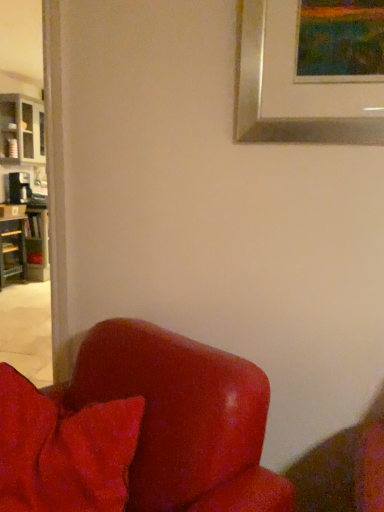
Question: Does velvety red pillow at lower left have a smaller size compared to wooden bookshelf at left?

Choices:
 (A) no
 (B) yes

Answer: (B)

Question: Considering the relative sizes of velvety red pillow at lower left and wooden bookshelf at left in the image provided, is velvety red pillow at lower left bigger than wooden bookshelf at left?

Choices:
 (A) yes
 (B) no

Answer: (B)

Question: Is velvety red pillow at lower left positioned in front of wooden bookshelf at left?

Choices:
 (A) yes
 (B) no

Answer: (A)

Question: From the image's perspective, would you say velvety red pillow at lower left is shown under wooden bookshelf at left?

Choices:
 (A) yes
 (B) no

Answer: (A)

Question: From the image's perspective, is velvety red pillow at lower left on wooden bookshelf at left?

Choices:
 (A) yes
 (B) no

Answer: (B)

Question: Can you confirm if velvety red pillow at lower left is positioned to the left of wooden bookshelf at left?

Choices:
 (A) yes
 (B) no

Answer: (B)

Question: Is matte gray cabinet at left outside of wooden bookshelf at left?

Choices:
 (A) yes
 (B) no

Answer: (A)

Question: Is matte gray cabinet at left next to wooden bookshelf at left and touching it?

Choices:
 (A) yes
 (B) no

Answer: (B)

Question: Does matte gray cabinet at left have a smaller size compared to wooden bookshelf at left?

Choices:
 (A) no
 (B) yes

Answer: (A)

Question: Does matte gray cabinet at left appear on the left side of wooden bookshelf at left?

Choices:
 (A) no
 (B) yes

Answer: (A)

Question: Are matte gray cabinet at left and wooden bookshelf at left far apart?

Choices:
 (A) yes
 (B) no

Answer: (A)

Question: Can you confirm if matte gray cabinet at left is bigger than wooden bookshelf at left?

Choices:
 (A) no
 (B) yes

Answer: (B)

Question: Can velvety red pillow at lower left be found inside wooden bookshelf at left?

Choices:
 (A) no
 (B) yes

Answer: (A)